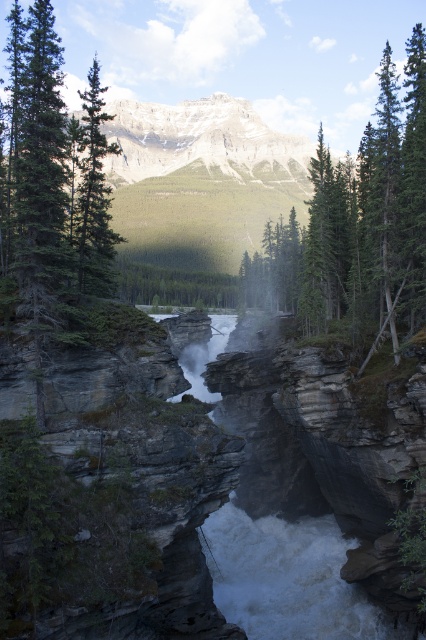
Question: Which of the following is the farthest from the observer?

Choices:
 (A) (414, 298)
 (B) (98, 204)

Answer: (B)

Question: Where is green matte tree at center located in relation to green matte tree at left in the image?

Choices:
 (A) right
 (B) left

Answer: (A)

Question: Does green matte tree at center have a smaller size compared to green matte tree at left?

Choices:
 (A) yes
 (B) no

Answer: (B)

Question: Which point is farther from the camera taking this photo?

Choices:
 (A) [x=75, y=209]
 (B) [x=367, y=269]

Answer: (B)

Question: Does green matte tree at center appear on the left side of green matte tree at left?

Choices:
 (A) yes
 (B) no

Answer: (B)

Question: Which of the following is the closest to the observer?

Choices:
 (A) green matte tree at center
 (B) green matte tree at left

Answer: (B)